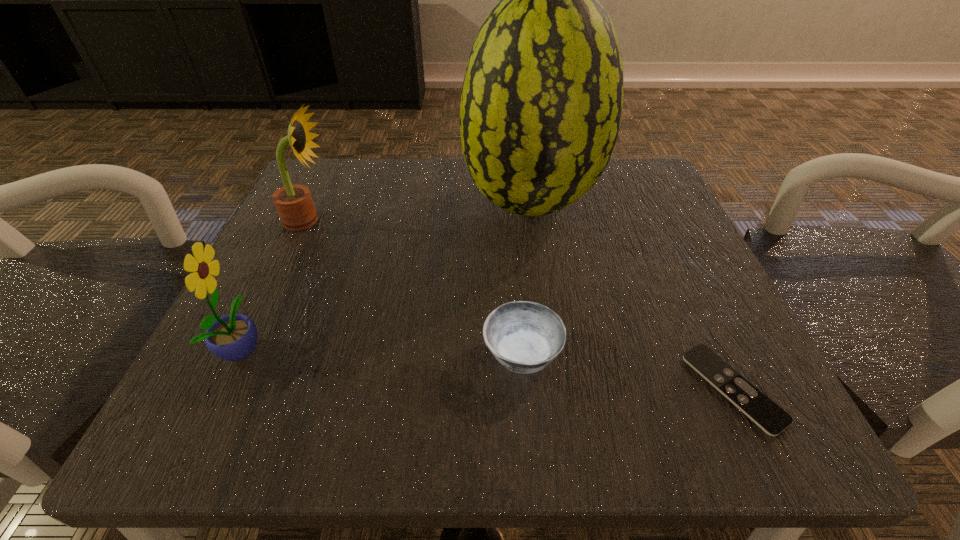
You are a GUI agent. You are given a task and a screenshot of the screen. Output one action in this format:
    pyautogui.click(x=<x>, y=<y>)
    Task: Click on the free space located 0.060m on the front-facing side of the shorter sunflower
    Image resolution: width=960 pixels, height=540 pixels.
    Given the screenshot: What is the action you would take?
    pyautogui.click(x=308, y=347)

Identify the location of free spot located on the right of the ashtray. The width and height of the screenshot is (960, 540). (700, 353).

The width and height of the screenshot is (960, 540). I want to click on blank area located on the back of the shortest object, so 660,232.

This screenshot has width=960, height=540. What are the coordinates of `watermelon that is at the far edge` in the screenshot? It's located at (541, 104).

Where is `sunflower present at the far edge`? sunflower present at the far edge is located at coordinates [x=294, y=204].

Locate an element on the screen. ashtray at the near edge is located at coordinates (525, 337).

Locate an element on the screen. The width and height of the screenshot is (960, 540). remote control that is at the near edge is located at coordinates (772, 419).

The image size is (960, 540). What are the coordinates of `watermelon present at the right edge` in the screenshot? It's located at (541, 104).

Identify the location of remote control that is positioned at the right edge. This screenshot has width=960, height=540. (772, 419).

Where is `object positioned at the far left corner`? This screenshot has width=960, height=540. object positioned at the far left corner is located at coordinates (294, 204).